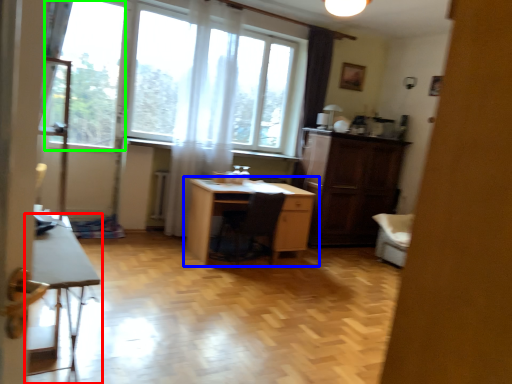
Question: Which object is positioned closest to table (highlighted by a red box)? Select from desk (highlighted by a blue box) and window screen (highlighted by a green box).

Choices:
 (A) desk
 (B) window screen

Answer: (A)